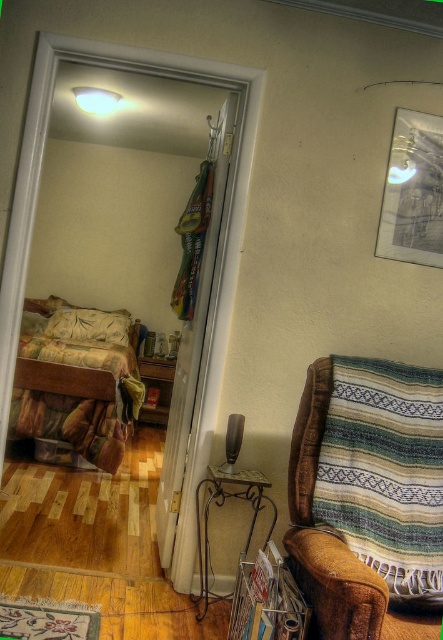
This screenshot has height=640, width=443. I want to click on floral fabric couch at left, so click(77, 380).

Does floral fabric couch at left appear on the left side of metallic silver picture frame at upper right?

Indeed, floral fabric couch at left is positioned on the left side of metallic silver picture frame at upper right.

Which is in front, point (28, 353) or point (392, 211)?

Point (392, 211) is more forward.

Where is `floral fabric couch at left`? The width and height of the screenshot is (443, 640). floral fabric couch at left is located at coordinates (77, 380).

Who is more distant from viewer, (97, 330) or (82, 88)?

Point (97, 330)

Who is taller, floral fabric couch at left or white glossy lampshade at upper center?

With more height is floral fabric couch at left.

Is point (27, 342) more distant than point (76, 102)?

No.

Locate an element on the screen. floral fabric couch at left is located at coordinates (77, 380).

Can you confirm if metallic silver picture frame at upper right is positioned below fluffy beige pillow at left?

No, metallic silver picture frame at upper right is not below fluffy beige pillow at left.

The image size is (443, 640). I want to click on metallic silver picture frame at upper right, so click(412, 192).